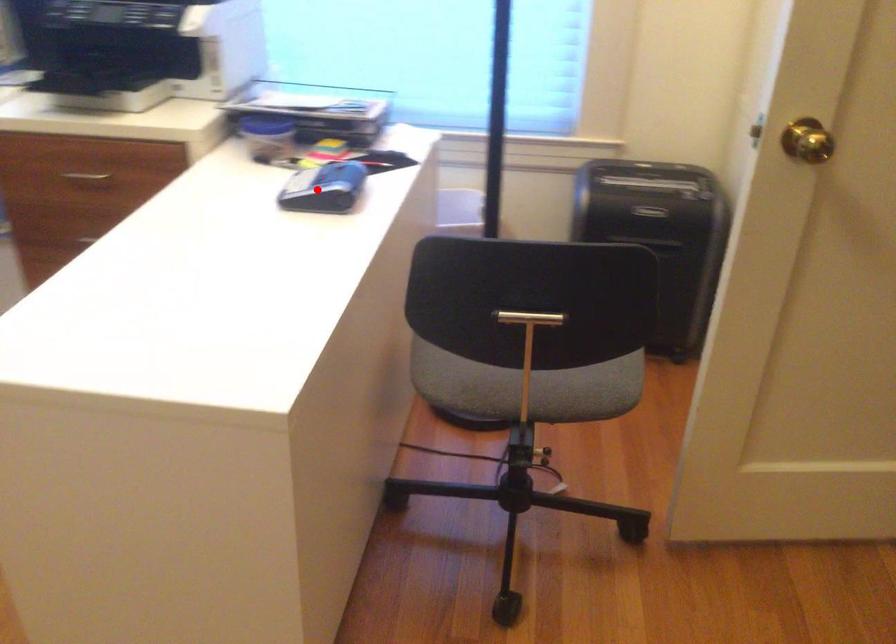
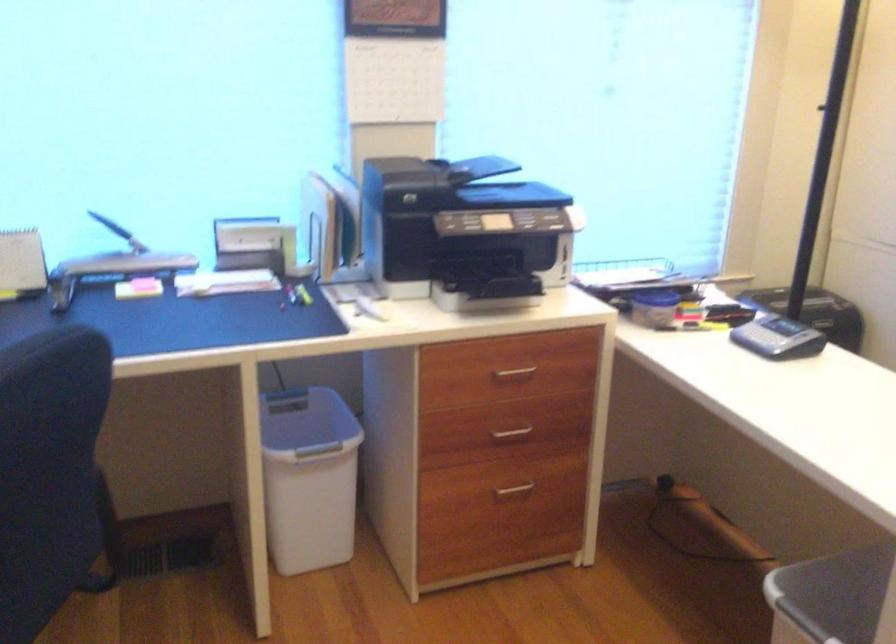
The point at the highlighted location is marked in the first image. Where is the corresponding point in the second image?

(778, 337)